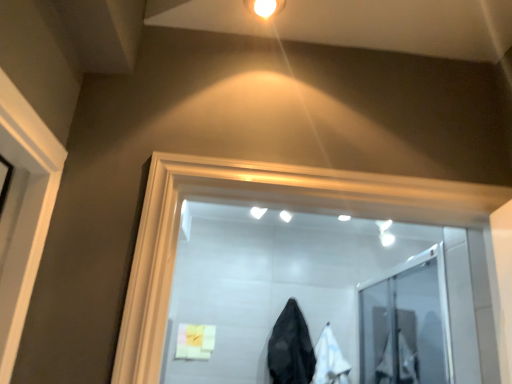
Question: Should I look upward or downward to see white fabric at center, which is the 2th garment in left-to-right order?

Choices:
 (A) up
 (B) down

Answer: (B)

Question: Can you confirm if white fabric at center, which ranks as the first garment in right-to-left order, is wider than black matte coat at center, the 2th garment viewed from the right?

Choices:
 (A) no
 (B) yes

Answer: (A)

Question: From a real-world perspective, is white fabric at center, which ranks as the first garment in right-to-left order, below black matte coat at center, the 2th garment viewed from the right?

Choices:
 (A) no
 (B) yes

Answer: (B)

Question: Is white fabric at center, which ranks as the first garment in right-to-left order, positioned with its back to black matte coat at center, the 2th garment viewed from the right?

Choices:
 (A) yes
 (B) no

Answer: (B)

Question: From the image's perspective, is white fabric at center, which is the 2th garment in left-to-right order, above black matte coat at center, the 2th garment viewed from the right?

Choices:
 (A) no
 (B) yes

Answer: (A)

Question: Is white fabric at center, which ranks as the first garment in right-to-left order, surrounding black matte coat at center, the first garment positioned from the left?

Choices:
 (A) yes
 (B) no

Answer: (B)

Question: Does white fabric at center, which ranks as the first garment in right-to-left order, appear on the right side of black matte coat at center, the first garment positioned from the left?

Choices:
 (A) no
 (B) yes

Answer: (B)

Question: From the image's perspective, is soft yellow cloth at lower center over black matte coat at center, the 2th garment viewed from the right?

Choices:
 (A) yes
 (B) no

Answer: (B)

Question: Could you tell me if soft yellow cloth at lower center is turned towards black matte coat at center, the 2th garment viewed from the right?

Choices:
 (A) yes
 (B) no

Answer: (B)

Question: Is soft yellow cloth at lower center thinner than black matte coat at center, the first garment positioned from the left?

Choices:
 (A) yes
 (B) no

Answer: (A)

Question: Would you say soft yellow cloth at lower center is a long distance from black matte coat at center, the 2th garment viewed from the right?

Choices:
 (A) yes
 (B) no

Answer: (B)

Question: Is soft yellow cloth at lower center not within black matte coat at center, the first garment positioned from the left?

Choices:
 (A) no
 (B) yes

Answer: (B)

Question: Is soft yellow cloth at lower center next to black matte coat at center, the first garment positioned from the left?

Choices:
 (A) yes
 (B) no

Answer: (B)

Question: From a real-world perspective, is black matte coat at center, the 2th garment viewed from the right, under white fabric at center, which is the 2th garment in left-to-right order?

Choices:
 (A) no
 (B) yes

Answer: (A)